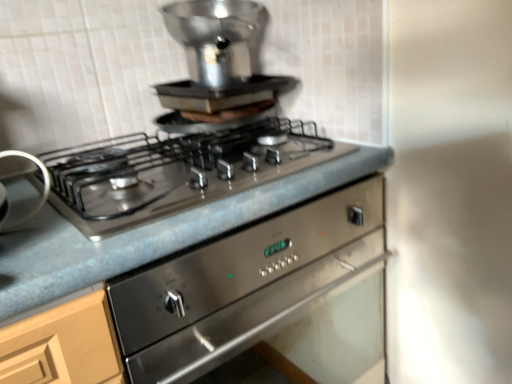
Question: Can you confirm if metallic gray countertop at center is wider than satin silver burner at left, the first appliance positioned from the bottom?

Choices:
 (A) no
 (B) yes

Answer: (B)

Question: Is the depth of metallic gray countertop at center greater than that of satin silver burner at left, placed as the 1th appliance when sorted from left to right?

Choices:
 (A) no
 (B) yes

Answer: (A)

Question: Is metallic gray countertop at center to the left of satin silver burner at left, which is counted as the second appliance, starting from the top, from the viewer's perspective?

Choices:
 (A) yes
 (B) no

Answer: (B)

Question: Can you confirm if metallic gray countertop at center is positioned to the right of satin silver burner at left, placed as the 2th appliance when sorted from right to left?

Choices:
 (A) yes
 (B) no

Answer: (A)

Question: Is metallic gray countertop at center aimed at satin silver burner at left, which is counted as the second appliance, starting from the top?

Choices:
 (A) yes
 (B) no

Answer: (B)

Question: Are metallic gray countertop at center and satin silver burner at left, placed as the 2th appliance when sorted from right to left, far apart?

Choices:
 (A) no
 (B) yes

Answer: (A)

Question: Would you say satin silver pot at upper center, positioned as the 1th appliance in top-to-bottom order, is part of metallic gray countertop at center's contents?

Choices:
 (A) yes
 (B) no

Answer: (B)

Question: Is metallic gray countertop at center not inside satin silver pot at upper center, positioned as the 1th appliance in top-to-bottom order?

Choices:
 (A) no
 (B) yes

Answer: (B)

Question: From a real-world perspective, is metallic gray countertop at center located higher than satin silver pot at upper center, positioned as the 1th appliance in top-to-bottom order?

Choices:
 (A) no
 (B) yes

Answer: (A)

Question: Is metallic gray countertop at center with satin silver pot at upper center, which is the first appliance in back-to-front order?

Choices:
 (A) yes
 (B) no

Answer: (B)

Question: Can you confirm if metallic gray countertop at center is shorter than satin silver pot at upper center, positioned as the 1th appliance in top-to-bottom order?

Choices:
 (A) yes
 (B) no

Answer: (B)

Question: Is metallic gray countertop at center further to the viewer compared to satin silver pot at upper center, which appears as the second appliance when ordered from the bottom?

Choices:
 (A) yes
 (B) no

Answer: (B)

Question: Considering the relative sizes of stainless steel gas stove at center and satin silver burner at left, which is counted as the second appliance, starting from the top, in the image provided, is stainless steel gas stove at center thinner than satin silver burner at left, which is counted as the second appliance, starting from the top,?

Choices:
 (A) no
 (B) yes

Answer: (A)